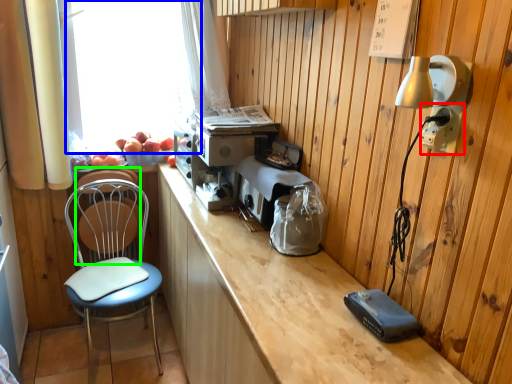
Question: Based on their relative distances, which object is nearer to electric outlet (highlighted by a red box)? Choose from window screen (highlighted by a blue box) and armchair (highlighted by a green box).

Choices:
 (A) window screen
 (B) armchair

Answer: (A)